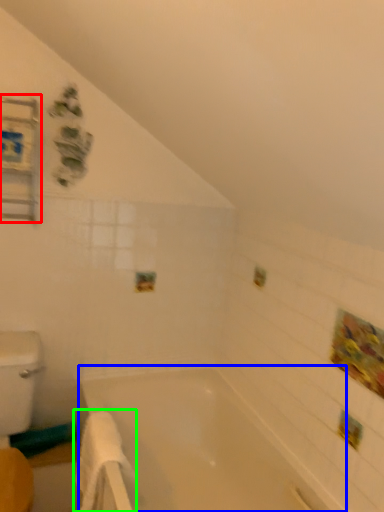
Question: Which object is the farthest from medicine cabinet (highlighted by a red box)? Choose among these: bathtub (highlighted by a blue box) or bath towel (highlighted by a green box).

Choices:
 (A) bathtub
 (B) bath towel

Answer: (A)